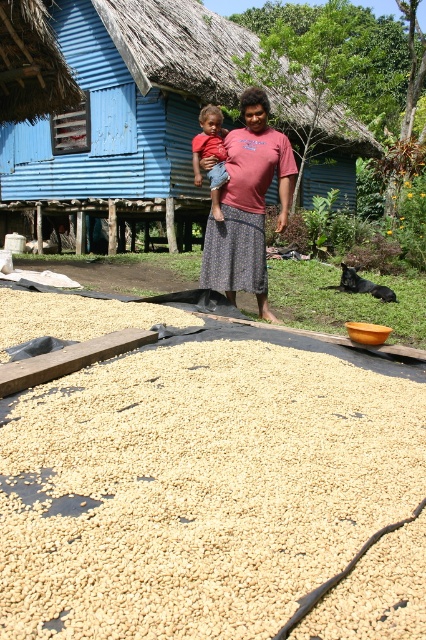
Question: Which is farther from the light brown denim shorts at center?

Choices:
 (A) light brown gravel at lower center
 (B) blue corrugated metal hut at upper left
 (C) matte pink shirt at center

Answer: (B)

Question: In this image, where is blue corrugated metal hut at upper left located relative to light brown denim shorts at center?

Choices:
 (A) above
 (B) below

Answer: (A)

Question: Is light brown gravel at lower center to the left of light brown denim shorts at center from the viewer's perspective?

Choices:
 (A) no
 (B) yes

Answer: (A)

Question: Can you confirm if light brown gravel at lower center is smaller than blue corrugated metal hut at upper left?

Choices:
 (A) no
 (B) yes

Answer: (B)

Question: Which object is the farthest from the matte pink shirt at center?

Choices:
 (A) blue corrugated metal hut at upper left
 (B) light brown gravel at lower center

Answer: (A)

Question: Which point appears farthest from the camera in this image?

Choices:
 (A) (270, 164)
 (B) (244, 388)
 (C) (158, 147)
 (D) (218, 179)

Answer: (C)